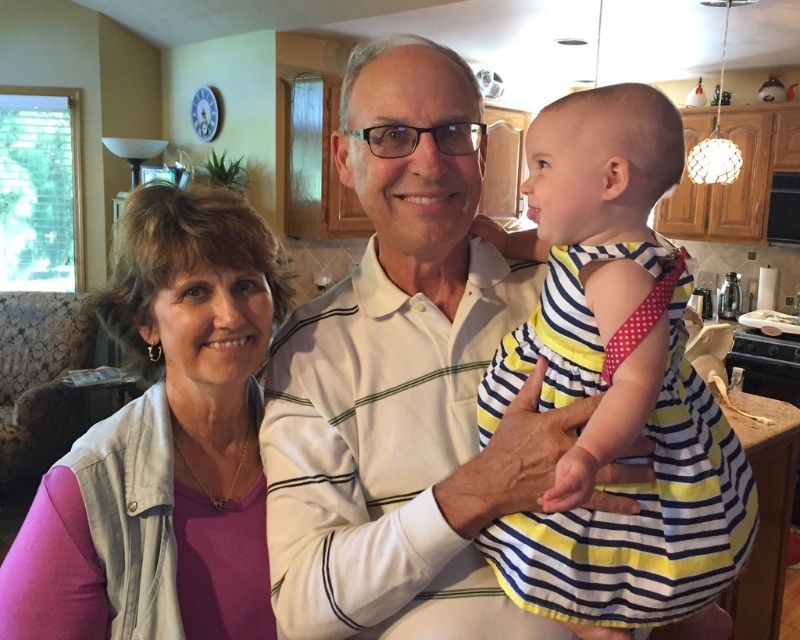
Question: Among these objects, which one is nearest to the camera?

Choices:
 (A) pink fabric at left
 (B) white striped shirt at center

Answer: (B)

Question: Does white striped shirt at center appear on the left side of pink fabric at left?

Choices:
 (A) no
 (B) yes

Answer: (A)

Question: Which object is positioned closest to the striped cotton dress at center?

Choices:
 (A) pink fabric at left
 (B) white striped shirt at center

Answer: (B)

Question: Can you confirm if white striped shirt at center is positioned to the left of striped cotton dress at center?

Choices:
 (A) yes
 (B) no

Answer: (A)

Question: Where is striped cotton dress at center located in relation to pink fabric at left in the image?

Choices:
 (A) below
 (B) above

Answer: (B)

Question: Which object is the farthest from the white striped shirt at center?

Choices:
 (A) pink fabric at left
 (B) striped cotton dress at center

Answer: (A)